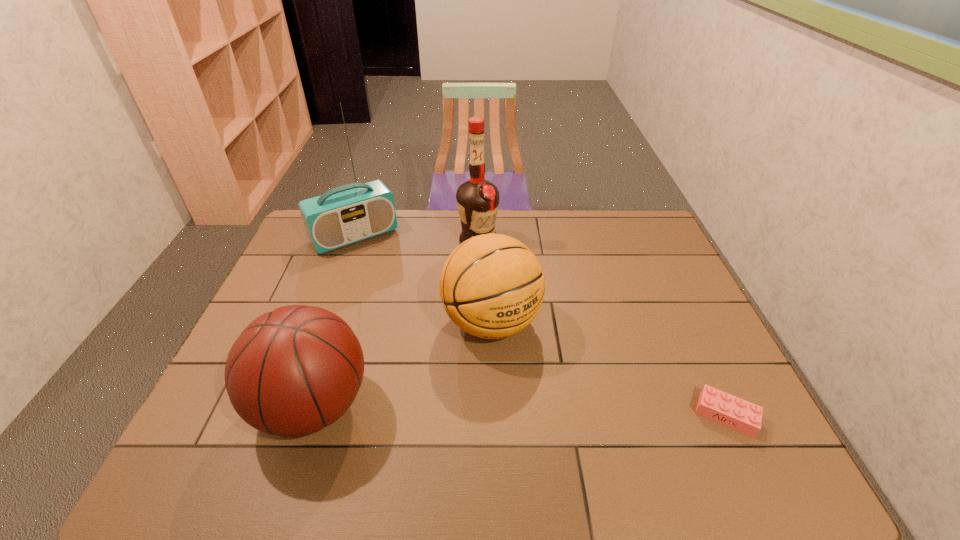
You are a GUI agent. You are given a task and a screenshot of the screen. Output one action in this format:
    pyautogui.click(x=<x>, y=<y>)
    Task: Click on the object that is the nearest to the liquor
    This screenshot has width=960, height=540.
    Given the screenshot: What is the action you would take?
    pyautogui.click(x=492, y=286)

Where is `vacant space that satisfies the following two spatial constraints: 1. on the back side of the liquor; 2. on the left side of the left basketball`? The width and height of the screenshot is (960, 540). vacant space that satisfies the following two spatial constraints: 1. on the back side of the liquor; 2. on the left side of the left basketball is located at coordinates (367, 241).

Image resolution: width=960 pixels, height=540 pixels. I want to click on vacant space that satisfies the following two spatial constraints: 1. on the back side of the left basketball; 2. on the left side of the right basketball, so click(x=340, y=322).

What are the coordinates of `free space that satisfies the following two spatial constraints: 1. on the front side of the radio receiver; 2. on the right side of the Lego` in the screenshot? It's located at (289, 415).